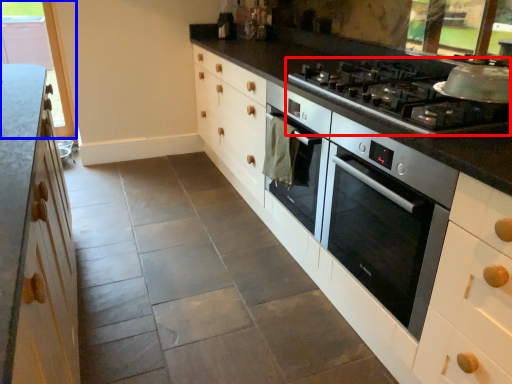
Question: Which object appears farthest to the camera in this image, gas stove (highlighted by a red box) or window (highlighted by a blue box)?

Choices:
 (A) gas stove
 (B) window

Answer: (B)